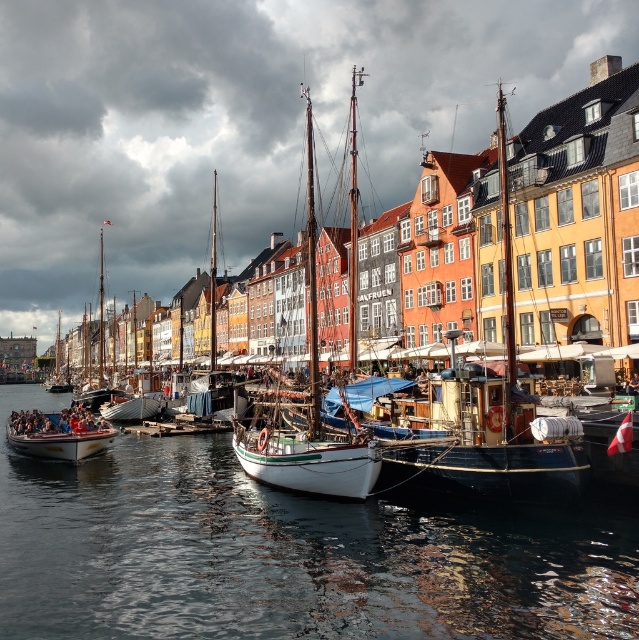
Question: Is wooden boat at center to the right of wooden sailboat at center from the viewer's perspective?

Choices:
 (A) no
 (B) yes

Answer: (A)

Question: Is wooden boat at center above white matte sailboat at center?

Choices:
 (A) no
 (B) yes

Answer: (B)

Question: Which object is the farthest from the wooden sailboat at center?

Choices:
 (A) wooden polished boat at lower left
 (B) wooden boat at center
 (C) white matte sailboat at center
 (D) clear water at center

Answer: (B)

Question: Which object is positioned closest to the wooden boat at center?

Choices:
 (A) wooden sailboat at center
 (B) wooden polished boat at lower left
 (C) white matte sailboat at center
 (D) clear water at center

Answer: (C)

Question: Which object is positioned farthest from the wooden polished boat at lower left?

Choices:
 (A) white matte sailboat at center
 (B) wooden sailboat at center

Answer: (A)

Question: Observing the image, what is the correct spatial positioning of clear water at center in reference to wooden sailboat at center?

Choices:
 (A) above
 (B) below

Answer: (B)